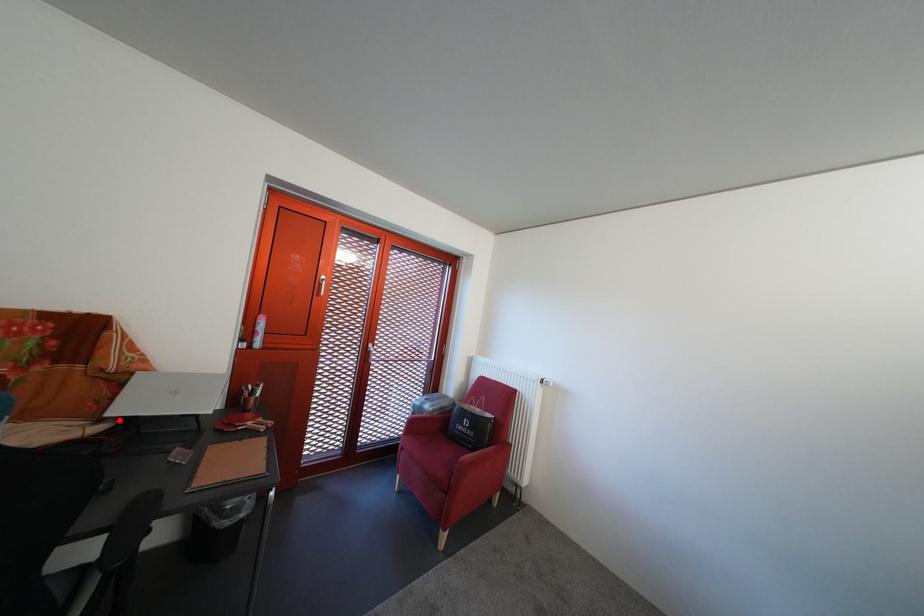
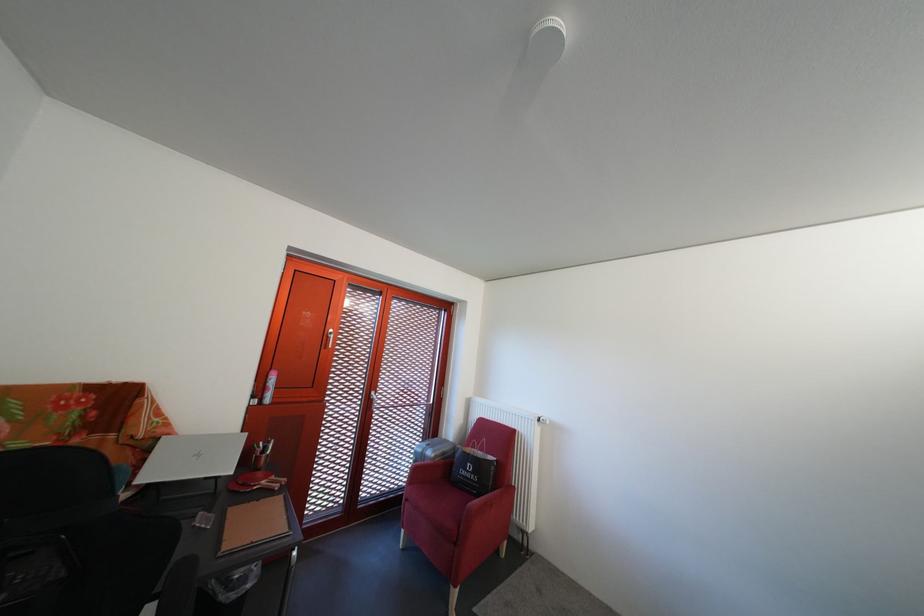
Question: I am providing you with two images of the same scene from different viewpoints. Image1 has a red point marked. In image2, the corresponding 3D location appears at what relative position? Reply with the corresponding letter.

Choices:
 (A) Closer
 (B) Farther

Answer: (B)